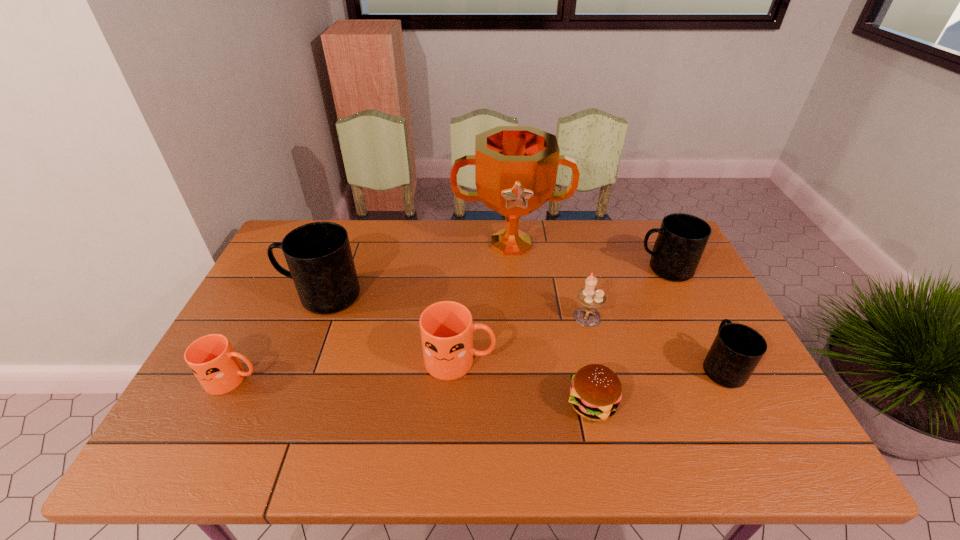
Where is `gold award`? The height and width of the screenshot is (540, 960). gold award is located at coordinates (516, 167).

Image resolution: width=960 pixels, height=540 pixels. Find the location of `the tallest object`. the tallest object is located at coordinates (516, 167).

In order to click on the leftmost black mug in this screenshot , I will do `click(319, 257)`.

The width and height of the screenshot is (960, 540). I want to click on the tallest mug, so click(319, 257).

In order to click on the second biggest black mug in this screenshot , I will do `click(682, 238)`.

Where is `candle holder`? candle holder is located at coordinates (590, 297).

I want to click on the right orange mug, so click(446, 327).

The image size is (960, 540). In order to click on the bigger orange mug in this screenshot , I will do `click(446, 327)`.

The image size is (960, 540). I want to click on the nearest black mug, so (737, 349).

Find the location of `the left orange mug`. the left orange mug is located at coordinates [x=211, y=358].